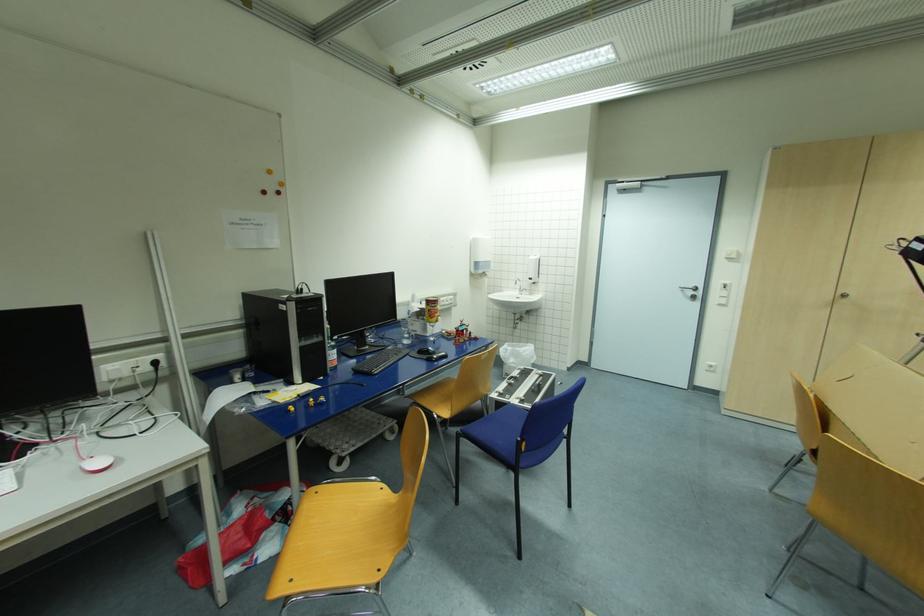
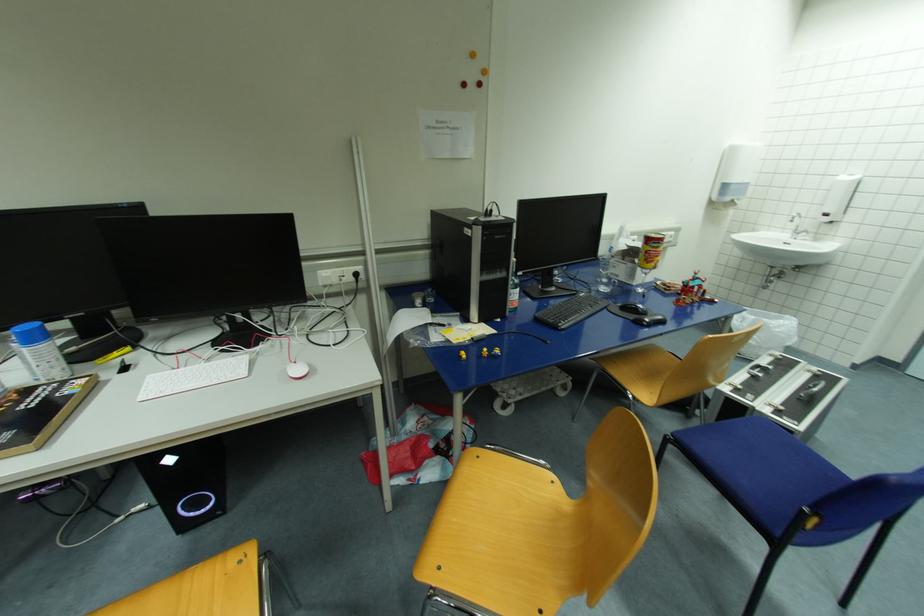
Question: I am providing you with two images of the same scene from different viewpoints. Which of the following objects are not visible in image2?

Choices:
 (A) red and yellow can
 (B) blue spray can
 (C) illuminated PC button
 (D) none of these

Answer: (D)